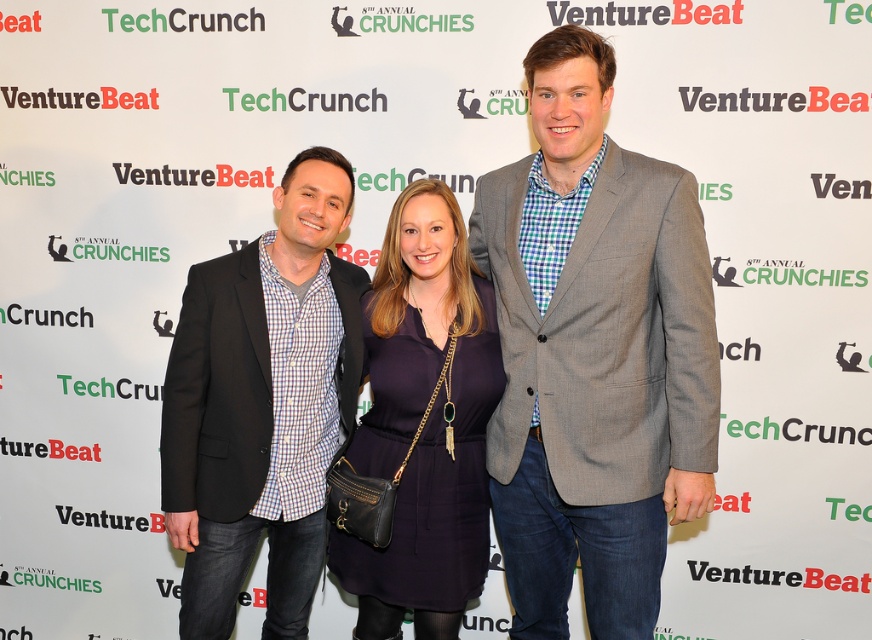
Question: Which point appears farthest from the camera in this image?

Choices:
 (A) (399, 340)
 (B) (182, 528)

Answer: (A)

Question: Does gray wool blazer at center have a smaller size compared to navy matte dress at center?

Choices:
 (A) no
 (B) yes

Answer: (A)

Question: Is gray wool blazer at center behind navy matte dress at center?

Choices:
 (A) no
 (B) yes

Answer: (A)

Question: Does gray wool blazer at center appear on the left side of navy matte dress at center?

Choices:
 (A) no
 (B) yes

Answer: (A)

Question: Among these objects, which one is nearest to the camera?

Choices:
 (A) navy matte dress at center
 (B) matte black blazer at center

Answer: (B)

Question: Among these objects, which one is farthest from the camera?

Choices:
 (A) navy matte dress at center
 (B) gray wool blazer at center
 (C) matte black blazer at center

Answer: (A)